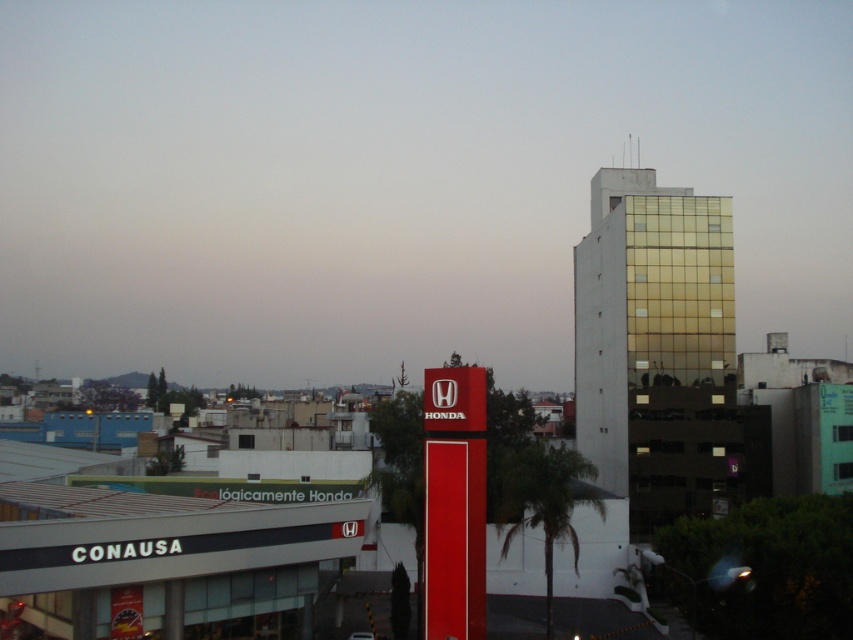
Which is above, red glossy sign at center or green leafy palm tree at center?

red glossy sign at center

From the picture: Is red glossy sign at center wider than green leafy palm tree at center?

Yes.

The image size is (853, 640). In order to click on red glossy sign at center in this screenshot , I will do `click(396, 177)`.

Who is lower down, gold glass building at center or green leafy palm tree at center?

green leafy palm tree at center is lower down.

Can you confirm if gold glass building at center is taller than green leafy palm tree at center?

Yes, gold glass building at center is taller than green leafy palm tree at center.

Does point (618, 285) lie behind point (546, 520)?

That is True.

Locate an element on the screen. The image size is (853, 640). gold glass building at center is located at coordinates (x=646, y=305).

Looking at this image, can you confirm if red glossy sign at center is wider than gold glass building at center?

Yes, red glossy sign at center is wider than gold glass building at center.

Where is `red glossy sign at center`? This screenshot has height=640, width=853. red glossy sign at center is located at coordinates (396, 177).